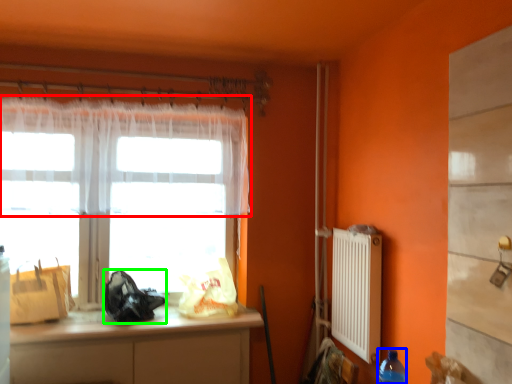
Question: Estimate the real-world distances between objects in this image. Which object is closer to curtain (highlighted by a red box), bottle (highlighted by a blue box) or bag (highlighted by a green box)?

Choices:
 (A) bottle
 (B) bag

Answer: (B)